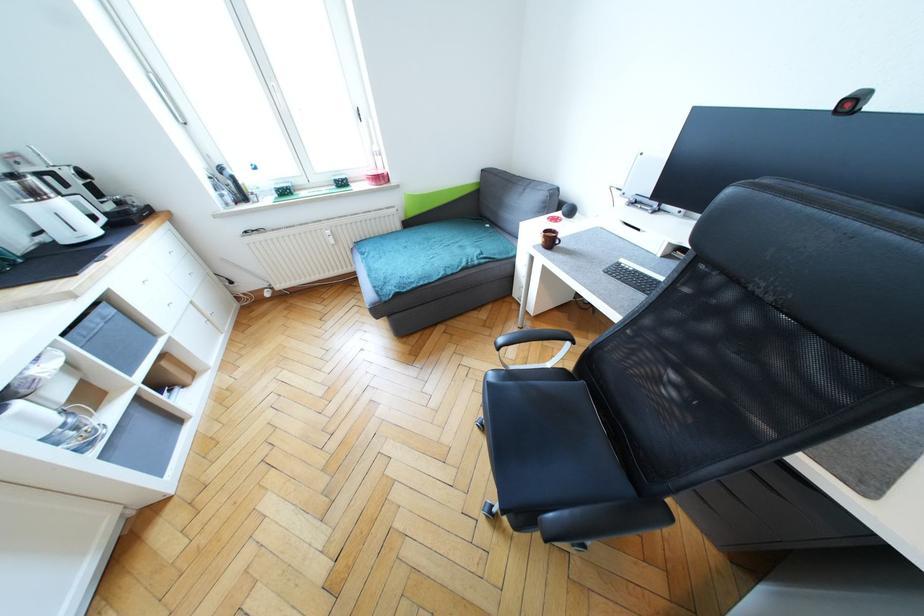
Identify the location of white kettle handle. The image size is (924, 616). (79, 416).